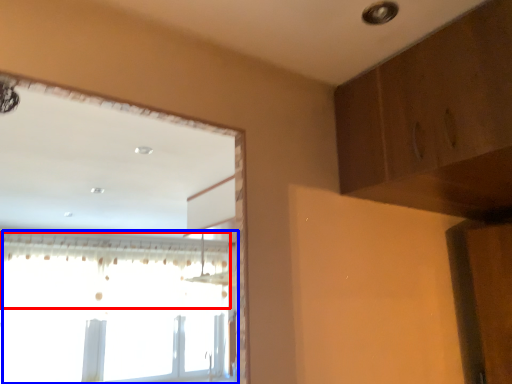
Question: Which object appears closest to the camera in this image, curtain (highlighted by a red box) or window (highlighted by a blue box)?

Choices:
 (A) curtain
 (B) window

Answer: (A)